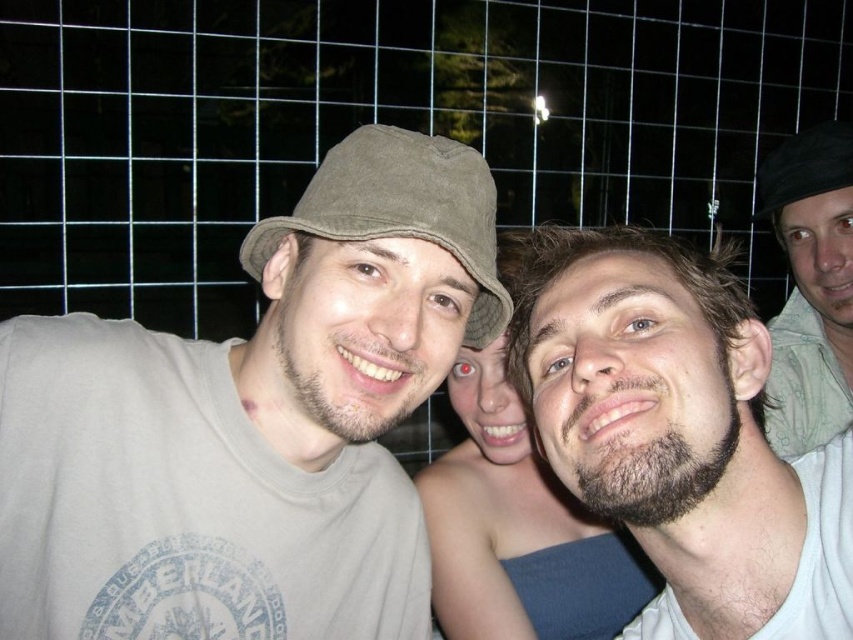
You are a photographer adjusting the focus on your camera. The camera has a focus point at coordinates 0.827, 0.608. Which subject in the photo should you focus on to capture the smooth skin at center clearly?

The smooth skin at center is located at point [518,529], so you should focus on the subject in the center to capture the smooth skin at center clearly.

You are a photographer trying to adjust the lighting for a night photo. The subjects are the bearded man at center. Based on their position at point 0.673, 0.794, where should you focus the light to ensure their face is well lit?

The bearded man at center is positioned at point (676, 429), so focusing the light at that coordinate will ensure their face is well lit.

You are a photographer adjusting the camera focus. The camera can only focus on objects within a 10 inch range. You need to focus on both the matte khaki bucket hat at center and the smooth skin at center. Can the camera focus on both at the same time?

The matte khaki bucket hat at center and smooth skin at center are 11.83 inches apart from each other. Since the camera can only focus on objects within a 0 to 10 inch range, the distance between them exceeds the focus range. Therefore, the camera cannot focus on both the matte khaki bucket hat at center and the smooth skin at center simultaneously.